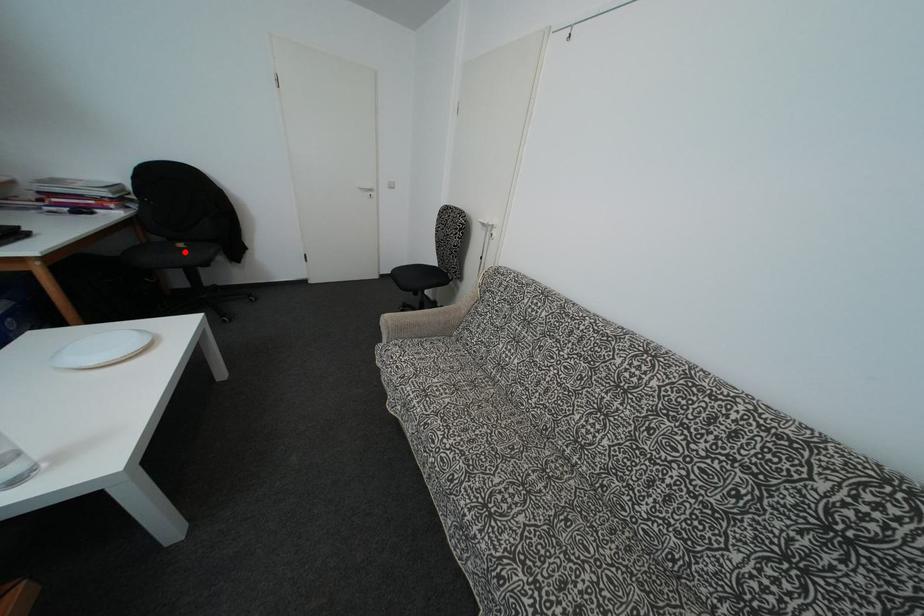
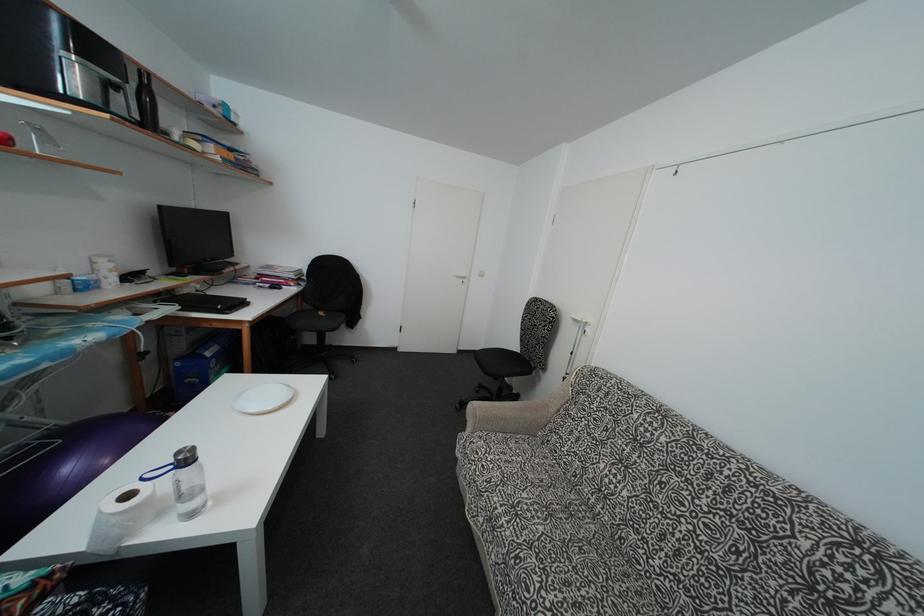
Find the pixel in the second image that matches the highlighted location in the first image.

(325, 320)